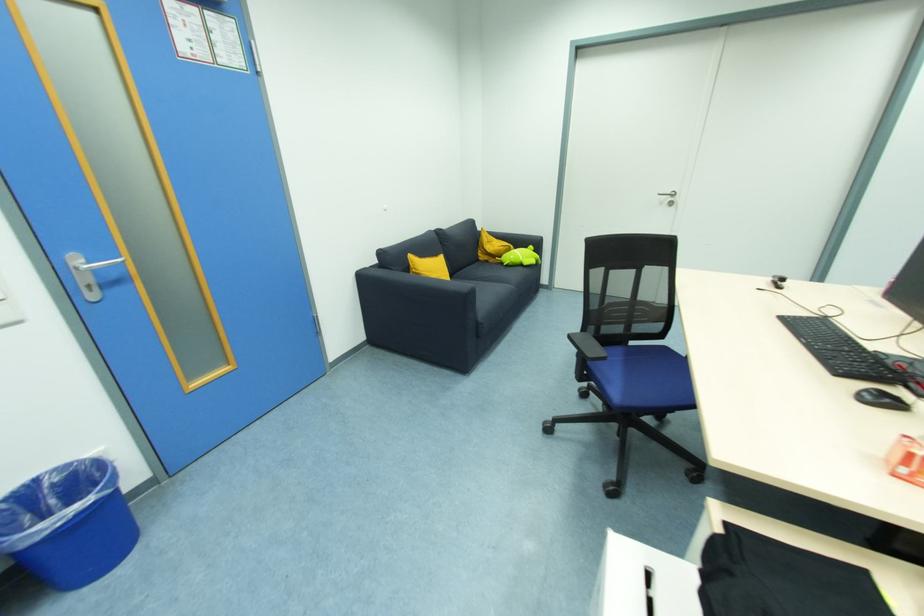
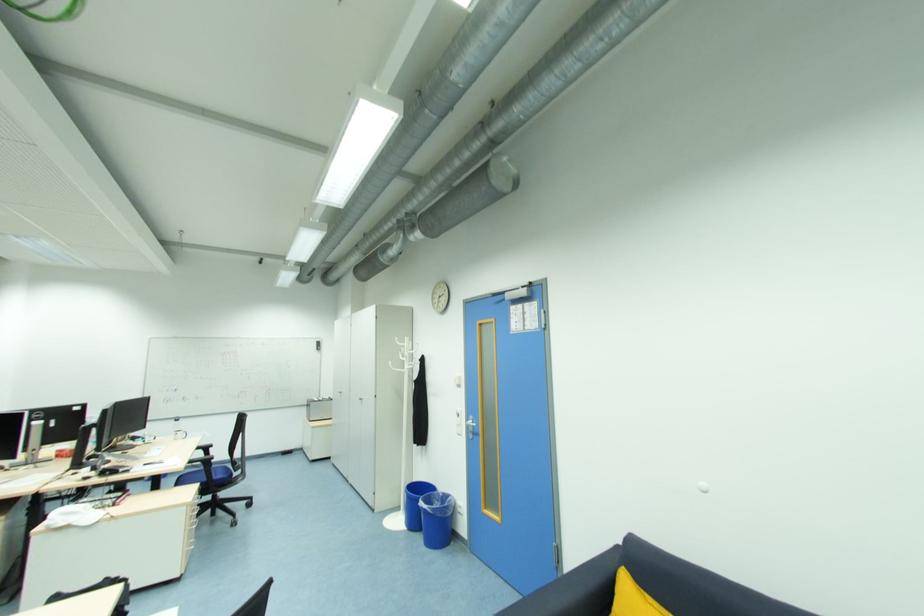
Find the pixel in the second image that matches pixel 411 256 in the first image.

(627, 569)